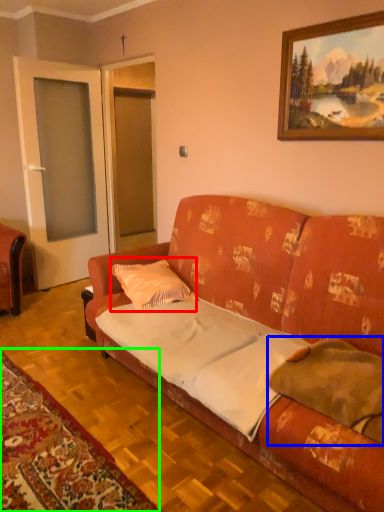
Question: Which object is positioned closest to pillow (highlighted by a red box)? Select from pillow (highlighted by a blue box) and mat (highlighted by a green box).

Choices:
 (A) pillow
 (B) mat

Answer: (B)